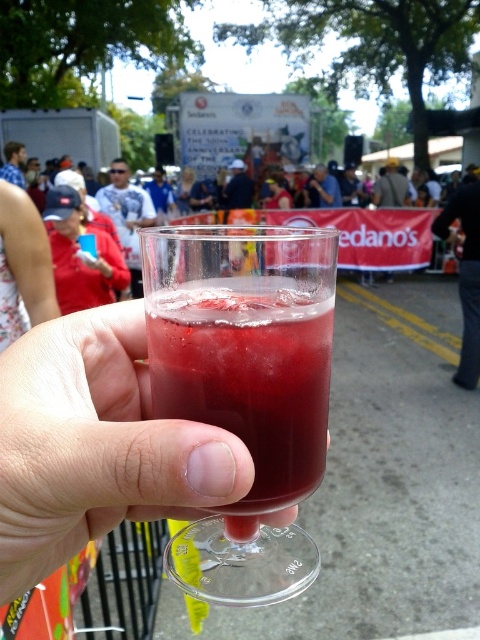
Question: Can you confirm if transparent glass at center is positioned below clear plastic cup at center?

Choices:
 (A) yes
 (B) no

Answer: (B)

Question: Which point is closer to the camera taking this photo?

Choices:
 (A) (226, 449)
 (B) (255, 499)

Answer: (A)

Question: Is transparent glass at center positioned behind clear plastic cup at center?

Choices:
 (A) yes
 (B) no

Answer: (A)

Question: From the image, what is the correct spatial relationship of transparent glass at center in relation to clear plastic cup at center?

Choices:
 (A) left
 (B) right

Answer: (B)